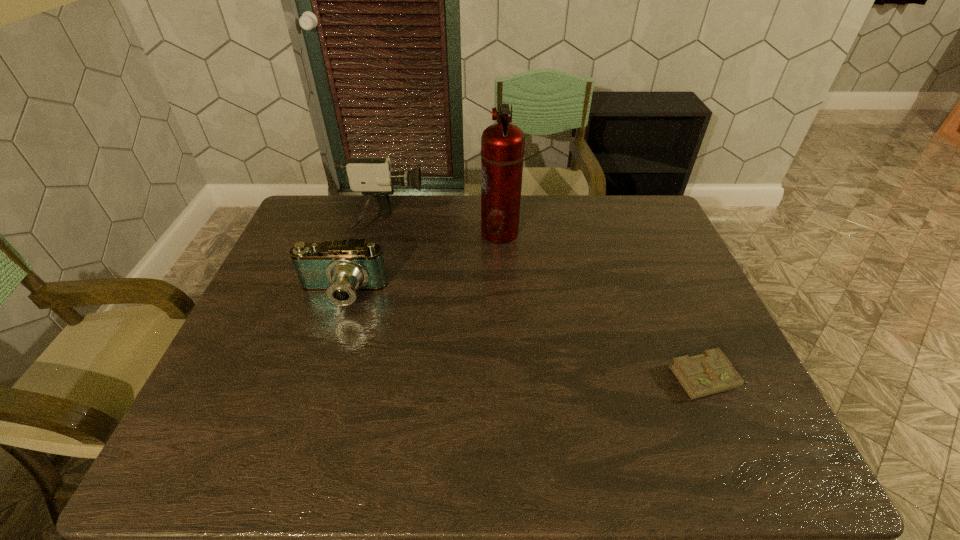
Find the location of a particular element. This screenshot has width=960, height=540. fire extinguisher is located at coordinates (502, 144).

At what (x,y) coordinates should I click in order to perform the action: click on the tallest object. Please return your answer as a coordinate pair (x, y). This screenshot has height=540, width=960. Looking at the image, I should click on click(x=502, y=144).

Where is `the taller camcorder`? The image size is (960, 540). the taller camcorder is located at coordinates (373, 177).

The width and height of the screenshot is (960, 540). I want to click on the farther camcorder, so click(373, 177).

Locate an element on the screen. the nearer camcorder is located at coordinates (340, 268).

Locate an element on the screen. This screenshot has width=960, height=540. the shorter camcorder is located at coordinates (340, 268).

Find the location of a particular element. This screenshot has height=540, width=960. diary is located at coordinates (711, 372).

You are a GUI agent. You are given a task and a screenshot of the screen. Output one action in this format:
    pyautogui.click(x=<x>, y=<y>)
    Task: Click on the rightmost object
    Image resolution: width=960 pixels, height=540 pixels.
    Given the screenshot: What is the action you would take?
    [x=711, y=372]

What are the coordinates of `vacant space positioned on the nozzle side of the third object from left to right` in the screenshot? It's located at (462, 232).

Locate an element on the screen. This screenshot has width=960, height=540. free space located on the nozzle side of the third object from left to right is located at coordinates (459, 232).